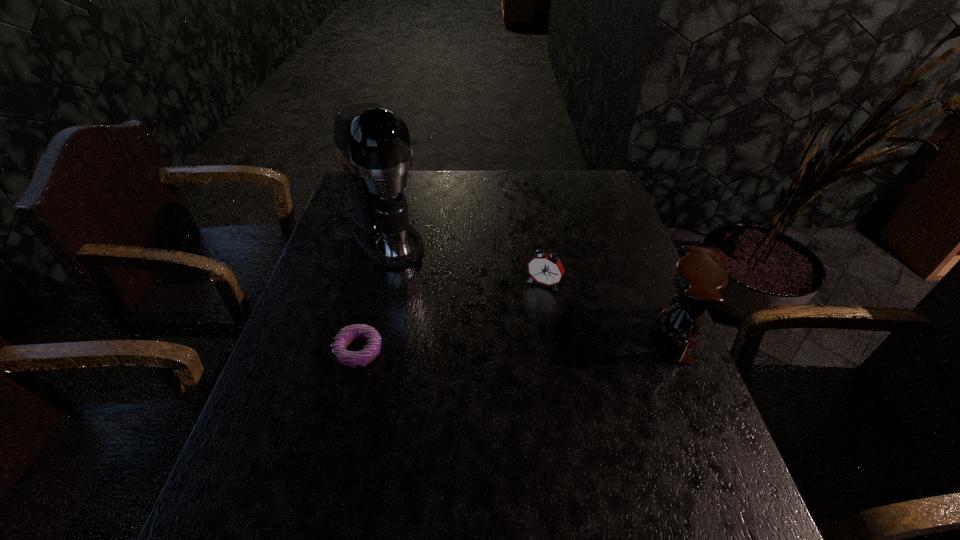
Find the location of `free space on the desktop that is between the doughnut and the hourglass and is positioned place cup under the spout of the farthest object`. free space on the desktop that is between the doughnut and the hourglass and is positioned place cup under the spout of the farthest object is located at coordinates (489, 345).

You are a GUI agent. You are given a task and a screenshot of the screen. Output one action in this format:
    pyautogui.click(x=<x>, y=<y>)
    Task: Click on the vacant space on the desktop that is between the shortest object and the hourglass and is positioned on the clock face of the second object from right to left
    
    Given the screenshot: What is the action you would take?
    coord(513,343)